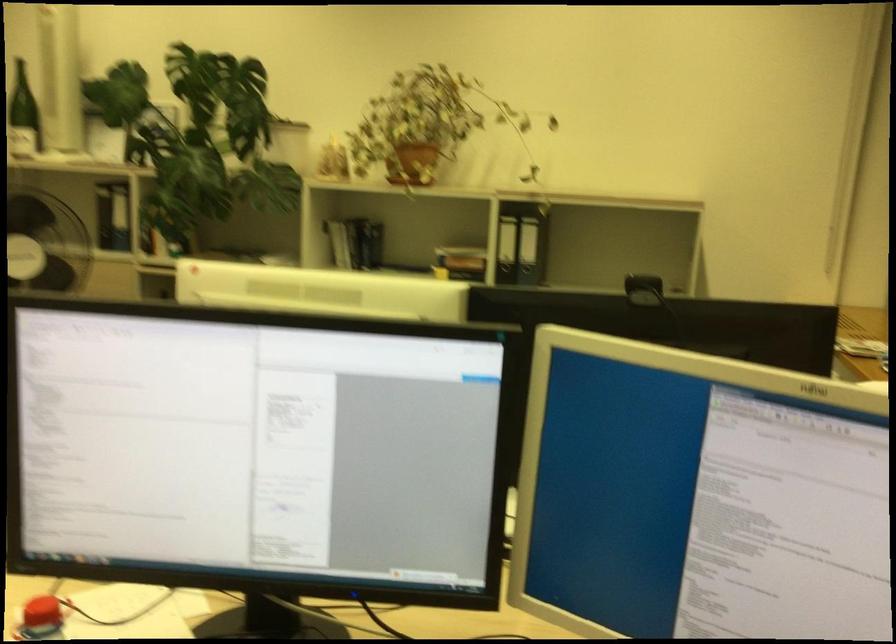
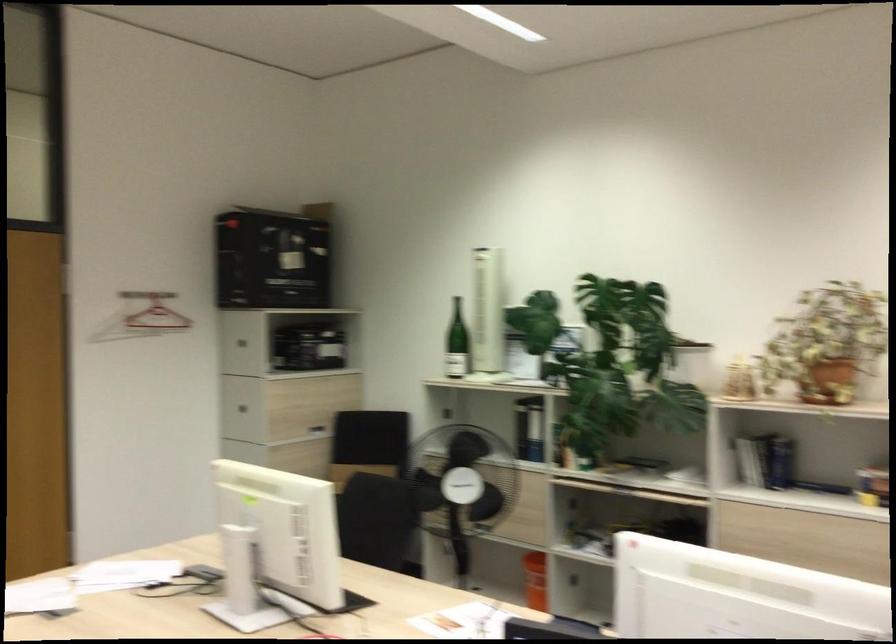
The images are taken continuously from a first-person perspective. In which direction are you moving?

The cameraman walked toward left, backward.